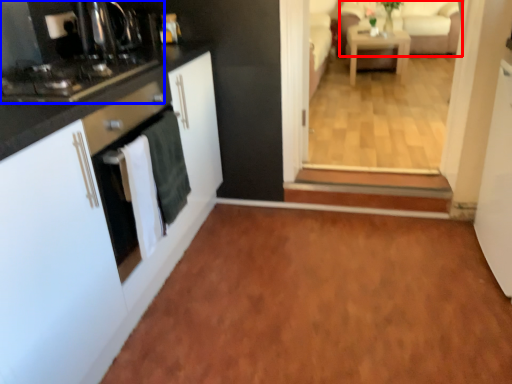
Question: Among these objects, which one is nearest to the camera, couch (highlighted by a red box) or home appliance (highlighted by a blue box)?

Choices:
 (A) couch
 (B) home appliance

Answer: (B)